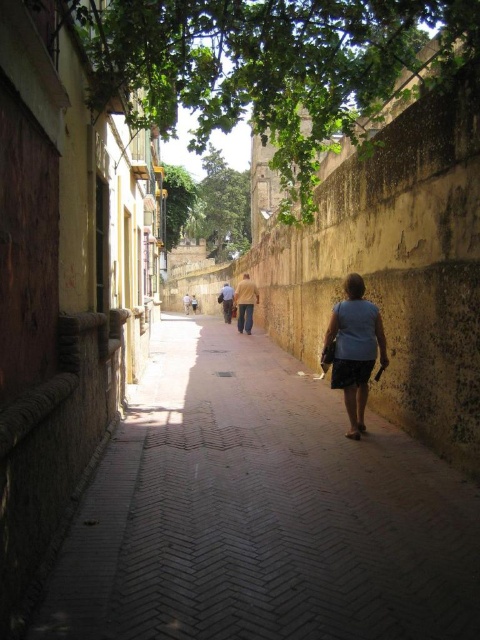
You are standing in the alleyway and want to step onto the brick paved walkway at center. Can you step onto it without moving the matte gray shirt at center?

The brick paved walkway at center is in front of the matte gray shirt at center, so you can step onto it without moving the matte gray shirt at center because it is located behind the walkway.

You are walking along the brick paved walkway at center in the alleyway. You notice a matte gray shirt at center lying on the ground. Which object occupies more space in the scene?

The brick paved walkway at center is bigger than matte gray shirt at center, so the brick paved walkway at center occupies more space in the scene.

You are standing in the narrow alleyway and notice two points marked on the ground. The first point is at coordinates point (389, 621) and the second is at point (350, 307). If you are facing the direction of the alley, which point is closer to you?

Point (389, 621) is in front of point (350, 307), so the first point is closer to you.